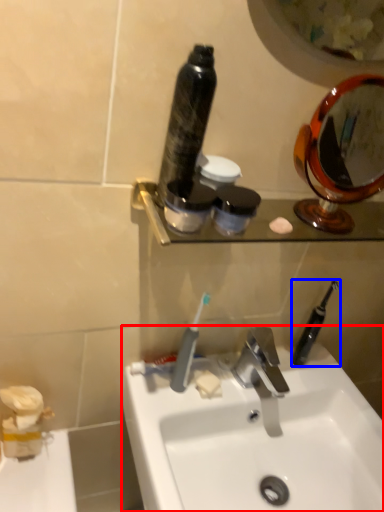
Question: Which object is closer to the camera taking this photo, sink (highlighted by a red box) or toothbrush (highlighted by a blue box)?

Choices:
 (A) sink
 (B) toothbrush

Answer: (A)